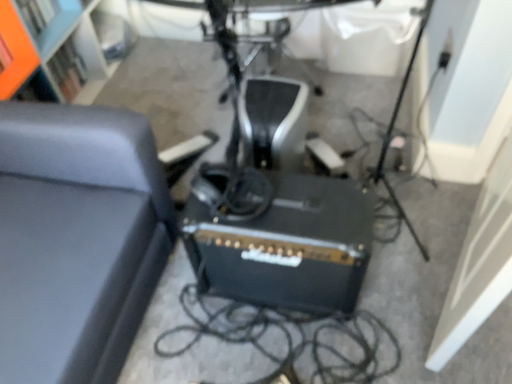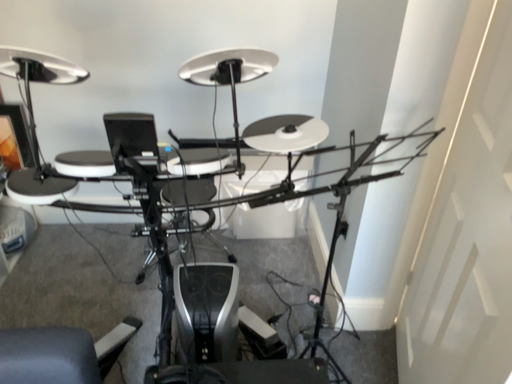
Question: Which way did the camera rotate in the video?

Choices:
 (A) rotated upward
 (B) rotated downward

Answer: (A)